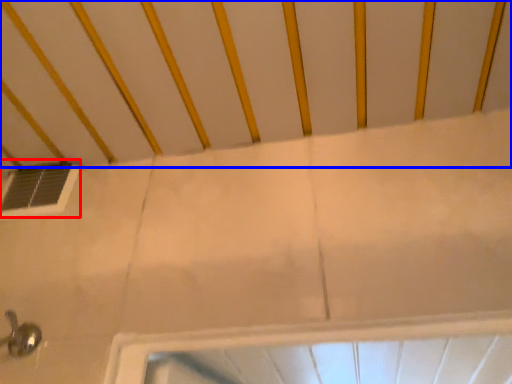
Question: Which of the following is the farthest to the observer, window (highlighted by a red box) or infant bed (highlighted by a blue box)?

Choices:
 (A) window
 (B) infant bed

Answer: (A)